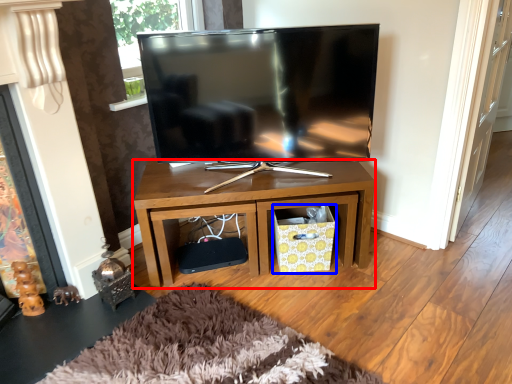
Question: Which object is closer to the camera taking this photo, desk (highlighted by a red box) or crate (highlighted by a blue box)?

Choices:
 (A) desk
 (B) crate

Answer: (A)